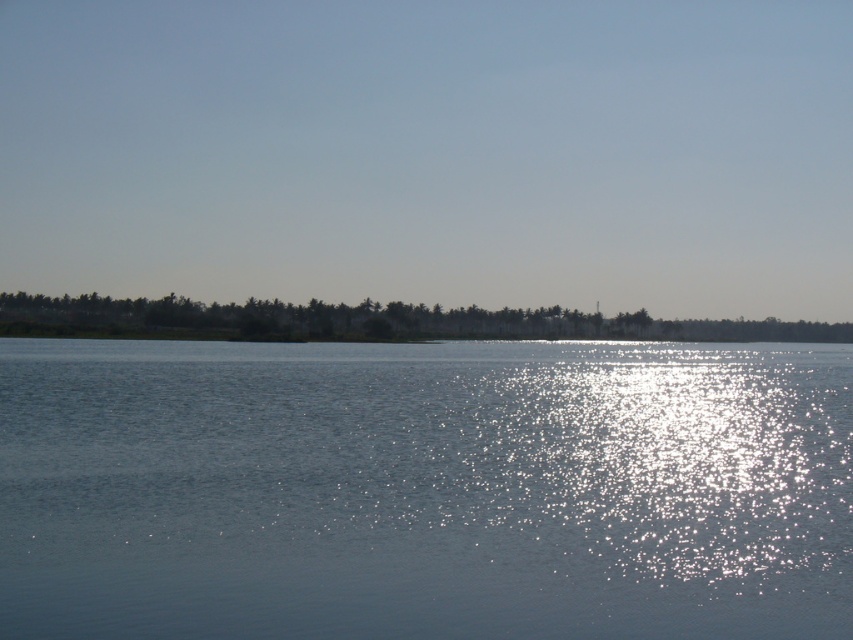
Between clear water at center and green leafy trees at lower center, which one is positioned lower?

clear water at center is below.

Is point (427, 492) farther from camera compared to point (421, 324)?

No.

What are the coordinates of `clear water at center` in the screenshot? It's located at (424, 490).